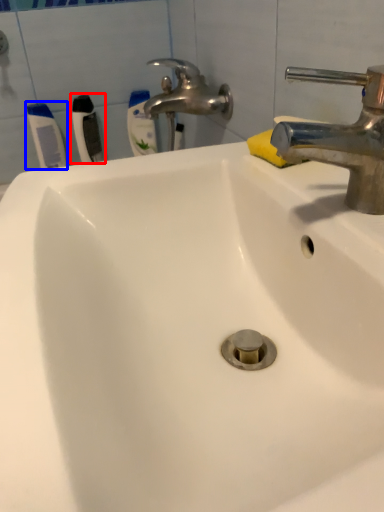
Question: Which point is further to the camera, toothbrush (highlighted by a red box) or toothbrush (highlighted by a blue box)?

Choices:
 (A) toothbrush
 (B) toothbrush

Answer: (B)